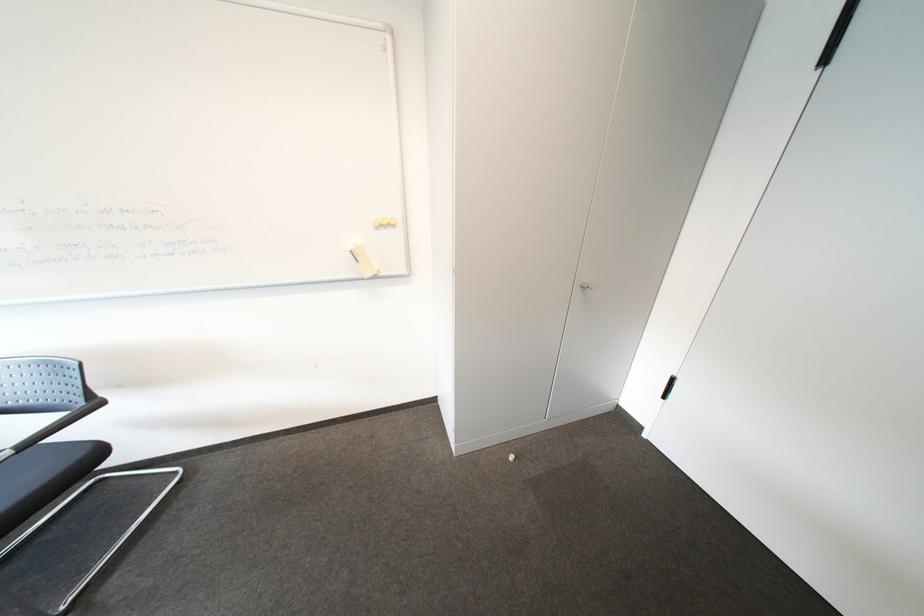
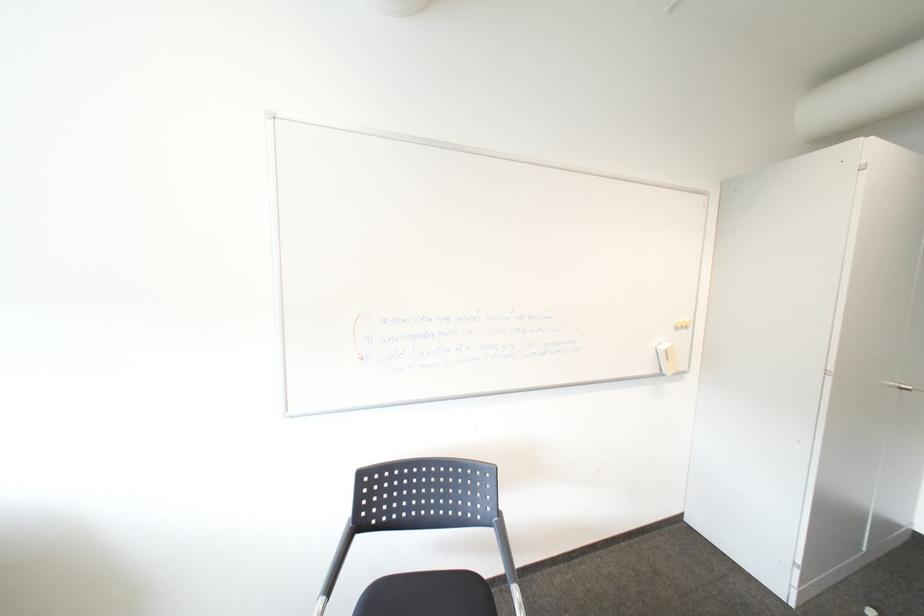
Question: The images are taken continuously from a first-person perspective. In which direction are you moving?

Choices:
 (A) Left
 (B) Right
 (C) Forward
 (D) Backward

Answer: (A)